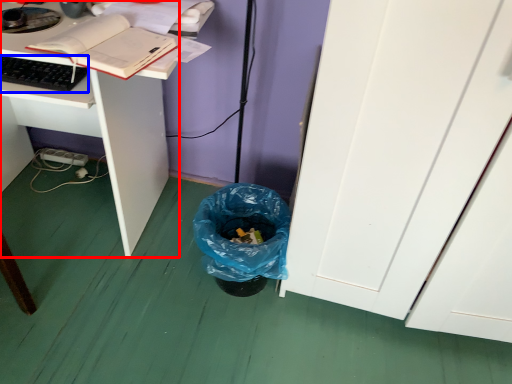
Question: Which object appears closest to the camera in this image, desk (highlighted by a red box) or computer keyboard (highlighted by a blue box)?

Choices:
 (A) desk
 (B) computer keyboard

Answer: (A)